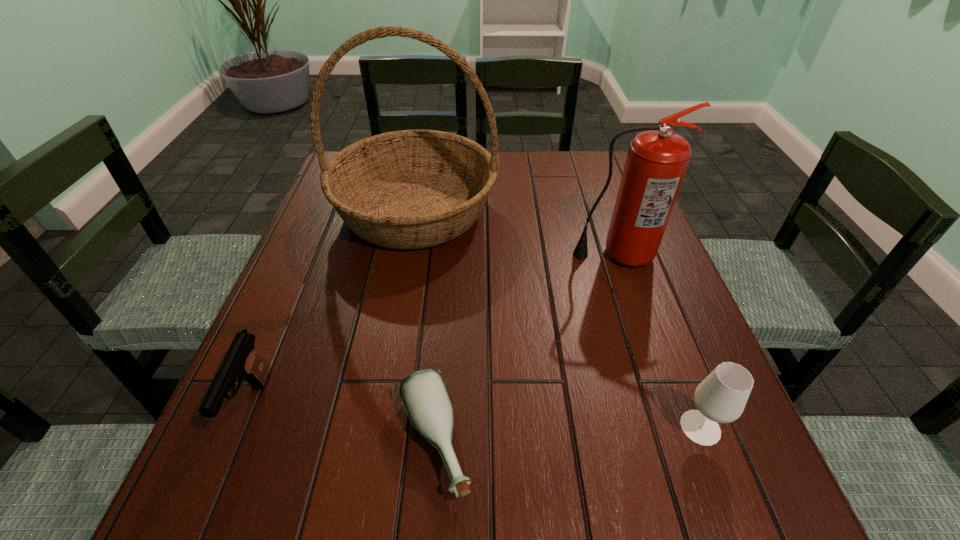
The width and height of the screenshot is (960, 540). What are the coordinates of `free space between the glass and the fire extinguisher` in the screenshot? It's located at (659, 341).

The width and height of the screenshot is (960, 540). In order to click on object that is the second closest one to the glass in this screenshot , I will do `click(657, 160)`.

Locate an element on the screen. This screenshot has width=960, height=540. the third closest object relative to the pistol is located at coordinates (657, 160).

The height and width of the screenshot is (540, 960). I want to click on free space that satisfies the following two spatial constraints: 1. at the barrel of the pistol; 2. on the right side of the bottle, so [x=235, y=442].

The height and width of the screenshot is (540, 960). I want to click on vacant space that satisfies the following two spatial constraints: 1. at the barrel of the bottle; 2. on the left side of the pistol, so click(235, 442).

Locate an element on the screen. blank space that satisfies the following two spatial constraints: 1. at the barrel of the third shortest object; 2. on the left side of the pistol is located at coordinates (242, 428).